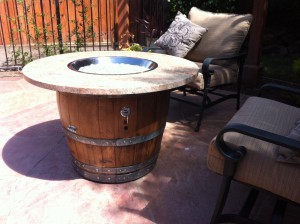
I want to click on chair used to sit on, so click(x=279, y=124), click(x=198, y=65).